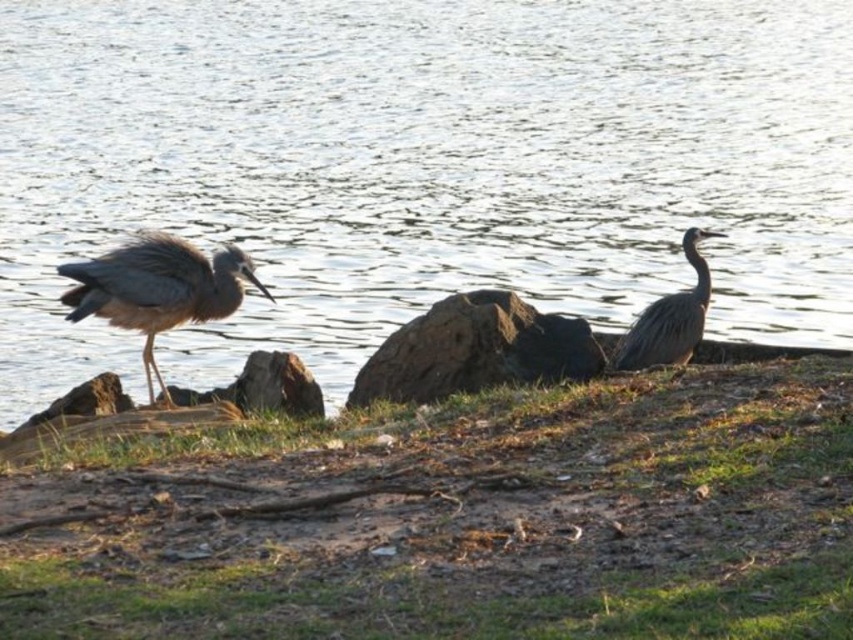
Based on the photo, is the position of green grass at lower center more distant than that of gray matte heron at left?

That is False.

Between green grass at lower center and gray matte heron at left, which one appears on the left side from the viewer's perspective?

Positioned to the left is gray matte heron at left.

Where is `green grass at lower center`? This screenshot has height=640, width=853. green grass at lower center is located at coordinates (460, 518).

Does clear water at center have a larger size compared to brown rough rock at center?

Yes, clear water at center is bigger than brown rough rock at center.

Can you confirm if clear water at center is thinner than brown rough rock at center?

In fact, clear water at center might be wider than brown rough rock at center.

Does point (91, 65) come behind point (540, 348)?

Yes, it is.

This screenshot has height=640, width=853. In order to click on clear water at center in this screenshot , I will do `click(419, 168)`.

Between point (73, 262) and point (682, 328), which one is positioned in front?

Point (73, 262) is in front.

Identify the location of gray matte heron at left. (157, 289).